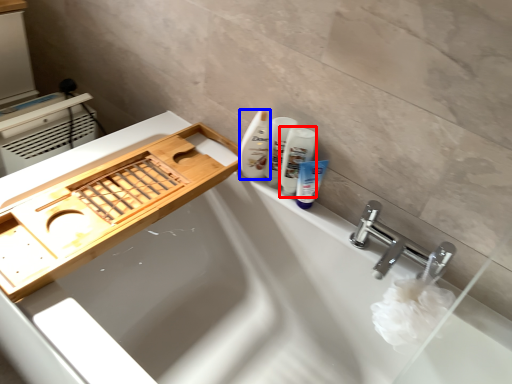
Question: Which of the following is the closest to the observer, mouthwash (highlighted by a red box) or cleaning product (highlighted by a blue box)?

Choices:
 (A) mouthwash
 (B) cleaning product

Answer: (A)